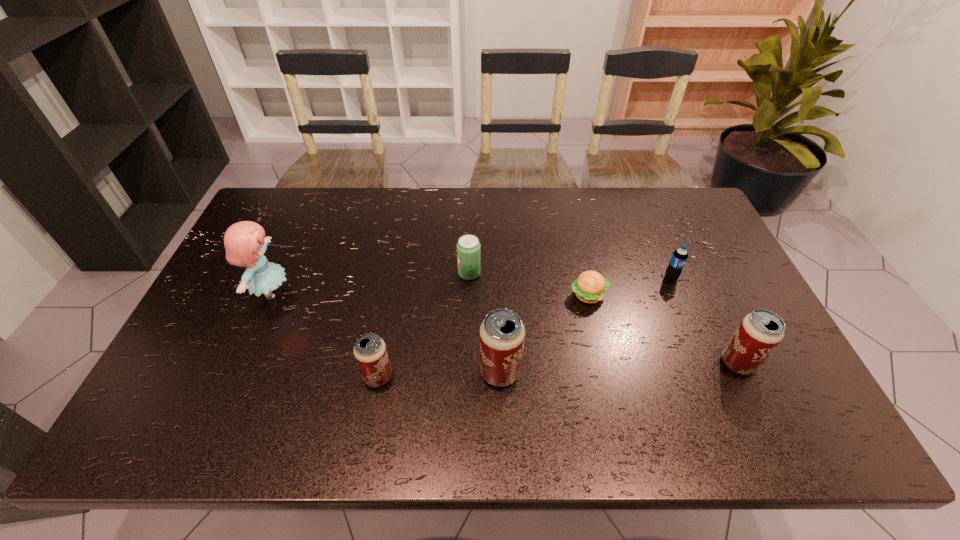
Please determine a free point for an extra beer_can to ensure balance. Please provide its 2D coordinates. Your answer should be formatted as a tuple, i.e. [(x, y)], where the tuple contains the x and y coordinates of a point satisfying the conditions above.

[(620, 368)]